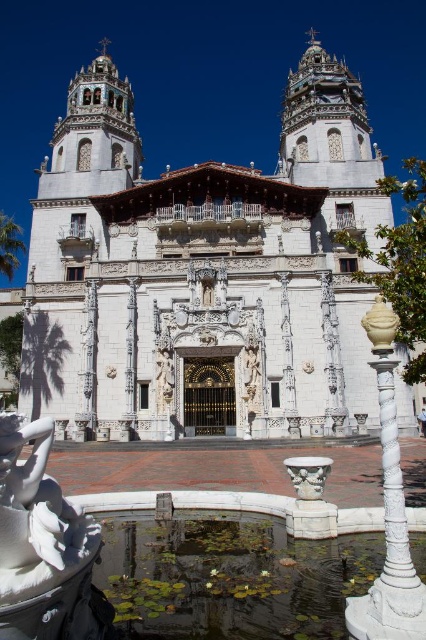
Question: Among these points, which one is nearest to the camera?

Choices:
 (A) (230, 348)
 (B) (412, 516)
 (C) (92, 612)

Answer: (C)

Question: Is white marble church at center thinner than white marble statue at lower left?

Choices:
 (A) yes
 (B) no

Answer: (B)

Question: Which point is closer to the camera?

Choices:
 (A) white marble statue at lower left
 (B) green leafy pond at lower center

Answer: (A)

Question: Does white marble church at center have a larger size compared to green leafy pond at lower center?

Choices:
 (A) no
 (B) yes

Answer: (B)

Question: Considering the relative positions of white marble church at center and white marble statue at lower left in the image provided, where is white marble church at center located with respect to white marble statue at lower left?

Choices:
 (A) below
 (B) above

Answer: (B)

Question: Estimate the real-world distances between objects in this image. Which object is farther from the green leafy pond at lower center?

Choices:
 (A) white marble church at center
 (B) white marble statue at lower left

Answer: (A)